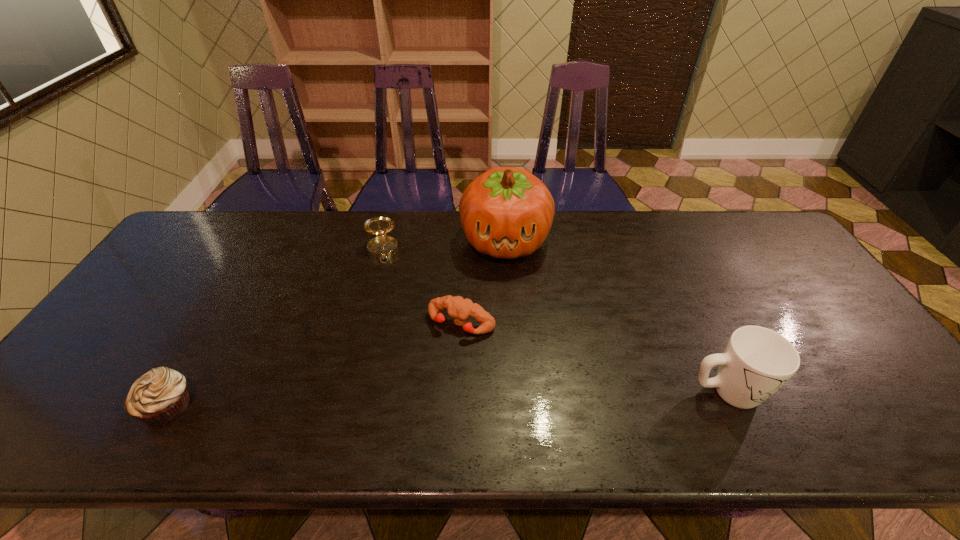
Locate an element on the screen. The width and height of the screenshot is (960, 540). compass at the far edge is located at coordinates (382, 247).

Where is `pumpkin that is at the far edge`? pumpkin that is at the far edge is located at coordinates (507, 212).

Locate an element on the screen. The width and height of the screenshot is (960, 540). muffin present at the near edge is located at coordinates (160, 396).

Identify the location of mug present at the near edge. [757, 362].

The height and width of the screenshot is (540, 960). Find the location of `vacant space at the far edge of the desktop`. vacant space at the far edge of the desktop is located at coordinates (701, 252).

At what (x,y) coordinates should I click in order to perform the action: click on vacant area at the near edge. Please return your answer as a coordinate pair (x, y). This screenshot has height=540, width=960. Looking at the image, I should click on (438, 408).

This screenshot has width=960, height=540. In the image, there is a desktop. What are the coordinates of `vacant region at the left edge` in the screenshot? It's located at (135, 305).

In the image, there is a desktop. Find the location of `vacant space at the right edge`. vacant space at the right edge is located at coordinates (859, 334).

I want to click on free space at the far right corner, so click(753, 237).

In the image, there is a desktop. Where is `free space at the near right corner`? free space at the near right corner is located at coordinates (859, 386).